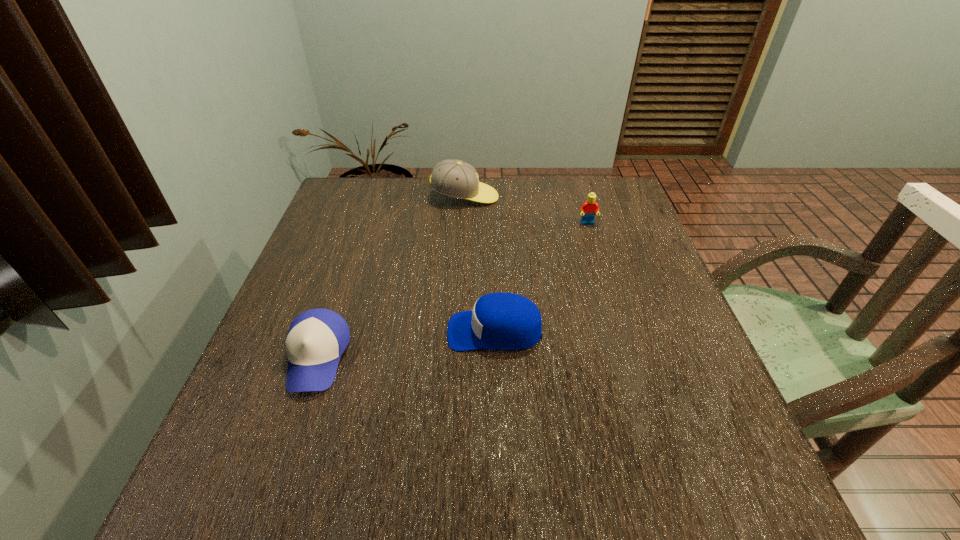
Locate an element on the screen. The width and height of the screenshot is (960, 540). object located in the left edge section of the desktop is located at coordinates (316, 339).

I want to click on object located in the right edge section of the desktop, so click(x=590, y=207).

The width and height of the screenshot is (960, 540). In order to click on object situated at the far right corner in this screenshot , I will do `click(590, 207)`.

Locate an element on the screen. blank space at the far edge of the desktop is located at coordinates (405, 219).

At what (x,y) coordinates should I click in order to perform the action: click on blank space at the near edge. Please return your answer as a coordinate pair (x, y). This screenshot has width=960, height=540. Looking at the image, I should click on (324, 467).

You are a GUI agent. You are given a task and a screenshot of the screen. Output one action in this format:
    pyautogui.click(x=<x>, y=<y>)
    Task: Click on the free spot at the left edge of the desktop
    The height and width of the screenshot is (540, 960).
    Given the screenshot: What is the action you would take?
    pyautogui.click(x=318, y=420)

This screenshot has height=540, width=960. In order to click on free space at the right edge of the desktop in this screenshot , I will do pyautogui.click(x=698, y=417).

Identify the location of free space at the far left corner. (365, 184).

Find the location of `vacant space at the far right corner of the desktop`. vacant space at the far right corner of the desktop is located at coordinates (573, 193).

Identify the location of vacant space that's between the farthest baseball cap and the second farthest object. This screenshot has height=540, width=960. (526, 210).